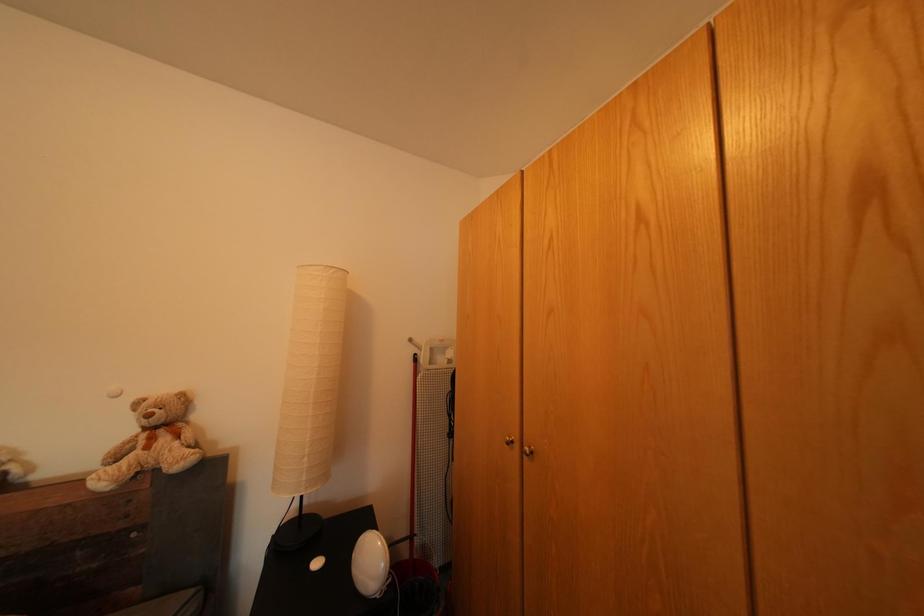
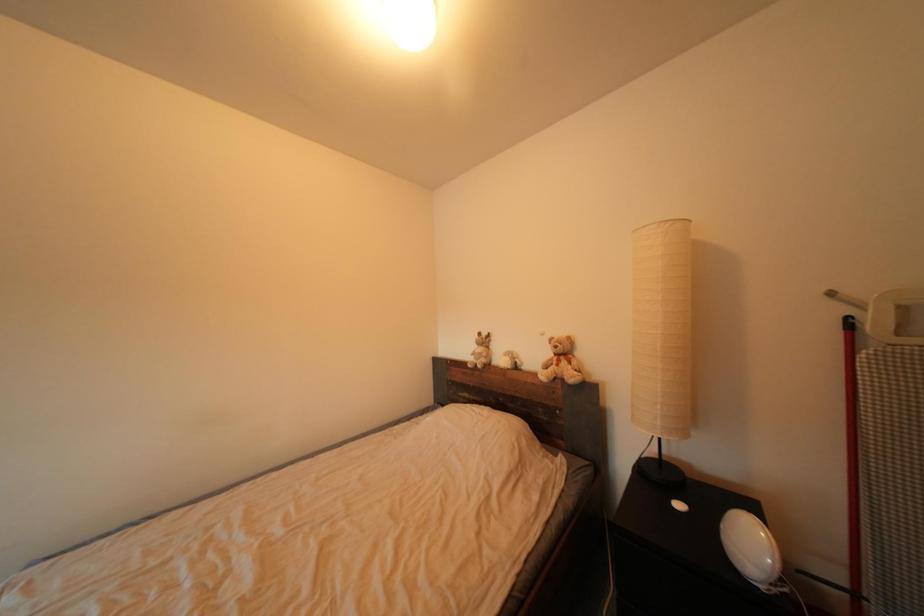
Question: The first image is from the beginning of the video and the second image is from the end. How did the camera likely rotate when shooting the video?

Choices:
 (A) Left
 (B) Right
 (C) Up
 (D) Down

Answer: (A)